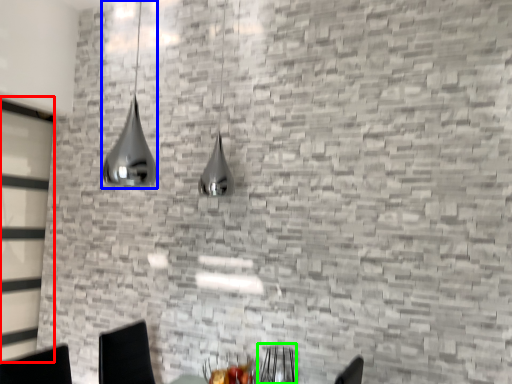
Question: Which object is positioned farthest from glass door (highlighted by a red box)? Select from lamp (highlighted by a blue box) and armchair (highlighted by a green box).

Choices:
 (A) lamp
 (B) armchair

Answer: (B)